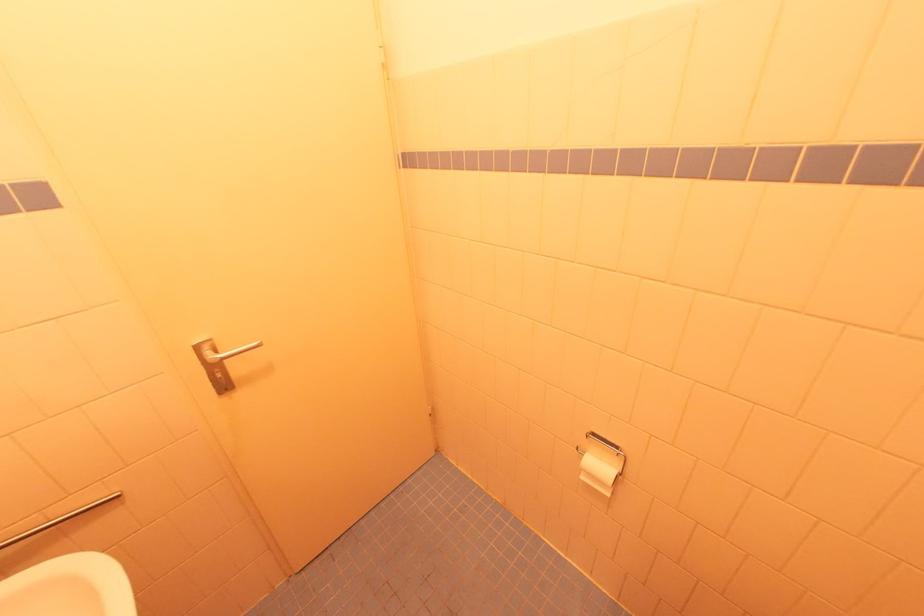
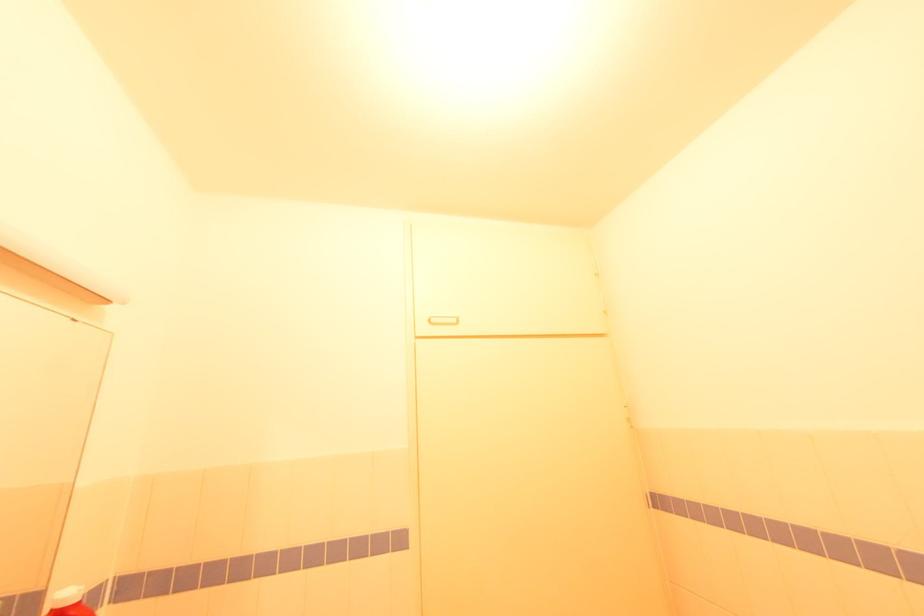
The first image is from the beginning of the video and the second image is from the end. How did the camera likely rotate when shooting the video?

The camera rotated toward left-up.